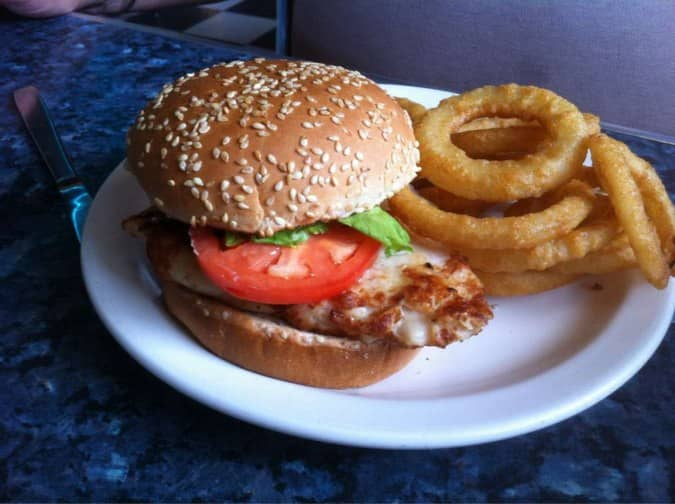
At what (x,y) coordinates should I click in order to perform the action: click on white plate. Please return your answer as a coordinate pair (x, y). The width and height of the screenshot is (675, 504). Looking at the image, I should click on (489, 373).